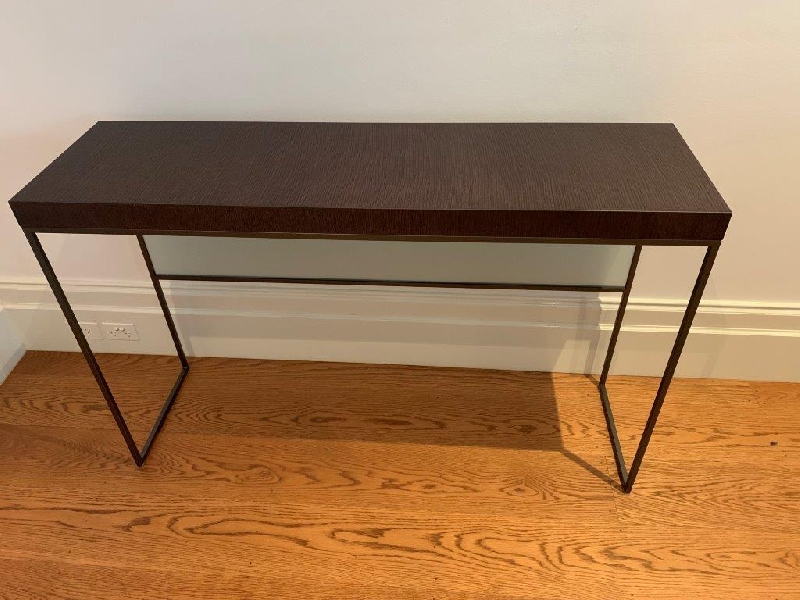
Image resolution: width=800 pixels, height=600 pixels. I want to click on socket, so click(126, 333).